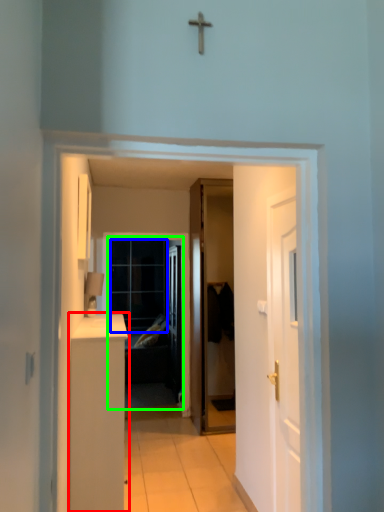
Question: Which object is the closest to the cabinetry (highlighted by a red box)? Choose among these: glass door (highlighted by a blue box) or screen door (highlighted by a green box).

Choices:
 (A) glass door
 (B) screen door

Answer: (A)